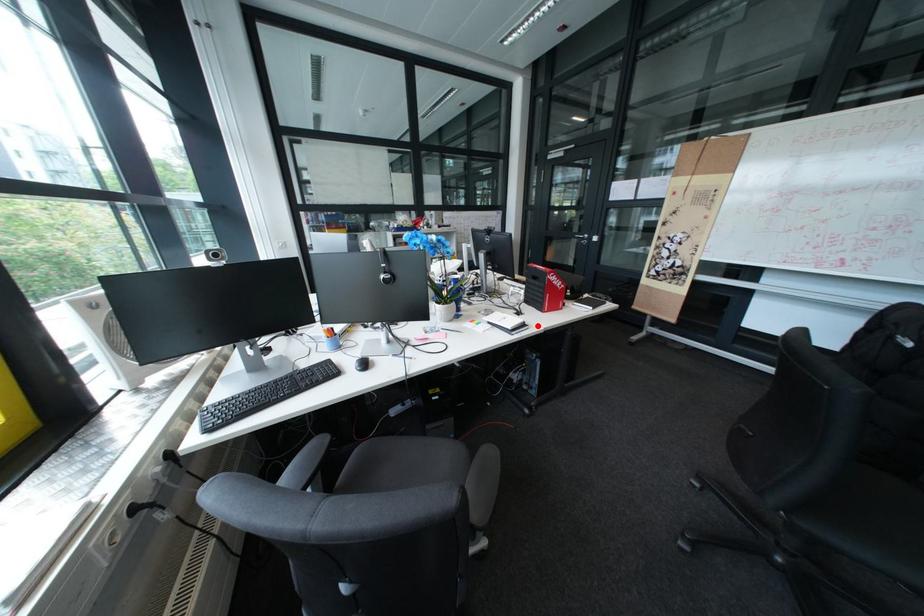
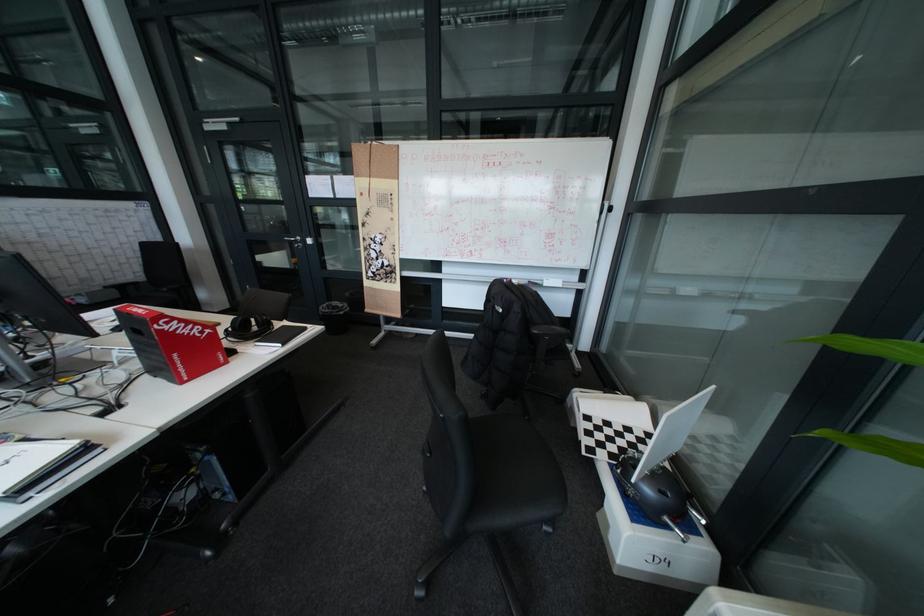
Where in the second image is the point corresponding to the highlighted location from the first image?

(99, 452)